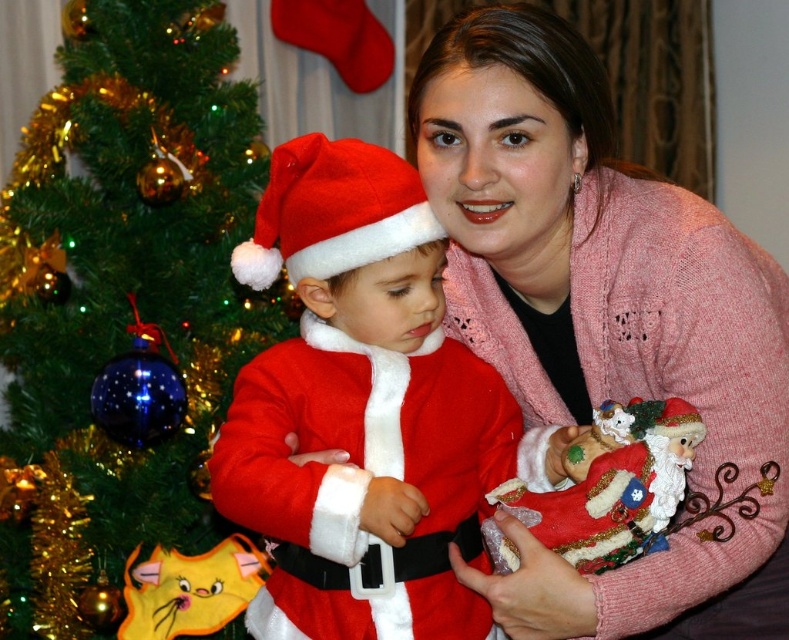
Question: Estimate the real-world distances between objects in this image. Which object is closer to the fluffy yellow cat at lower left?

Choices:
 (A) pink knitted sweater at center
 (B) velvet red santa at center

Answer: (B)

Question: Which point is farther to the camera?

Choices:
 (A) (484, 140)
 (B) (268, 387)
 (C) (634, 449)

Answer: (B)

Question: Considering the real-world distances, which object is farthest from the green textured christmas tree at left?

Choices:
 (A) fluffy yellow cat at lower left
 (B) pink knitted sweater at center
 (C) fuzzy red santa suit at center
 (D) fuzzy felt santa hat at center

Answer: (B)

Question: Can you confirm if green textured christmas tree at left is bigger than fluffy yellow cat at lower left?

Choices:
 (A) no
 (B) yes

Answer: (B)

Question: Can you confirm if green textured christmas tree at left is wider than fuzzy felt santa hat at center?

Choices:
 (A) no
 (B) yes

Answer: (B)

Question: Is velvet red santa at center positioned at the back of fuzzy felt santa hat at center?

Choices:
 (A) yes
 (B) no

Answer: (B)